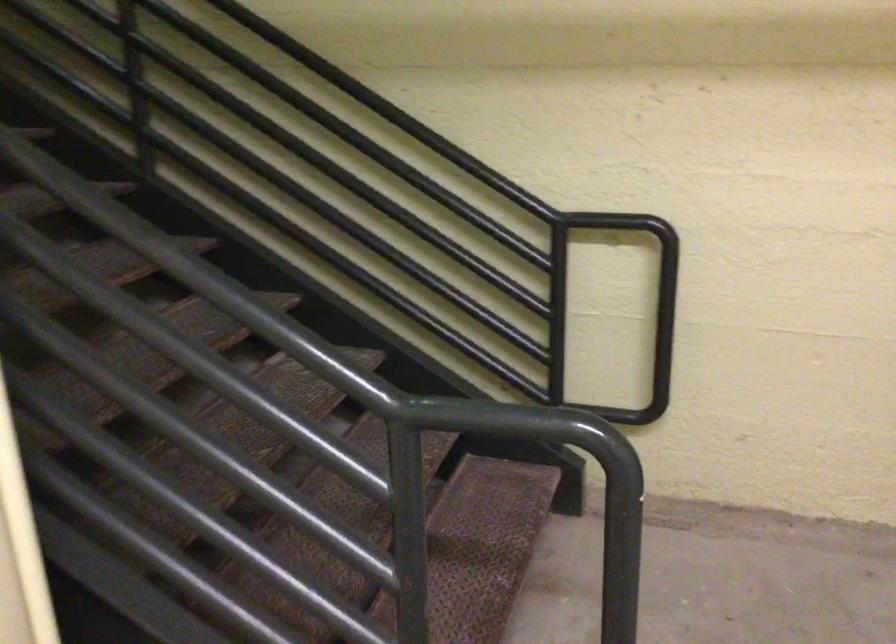
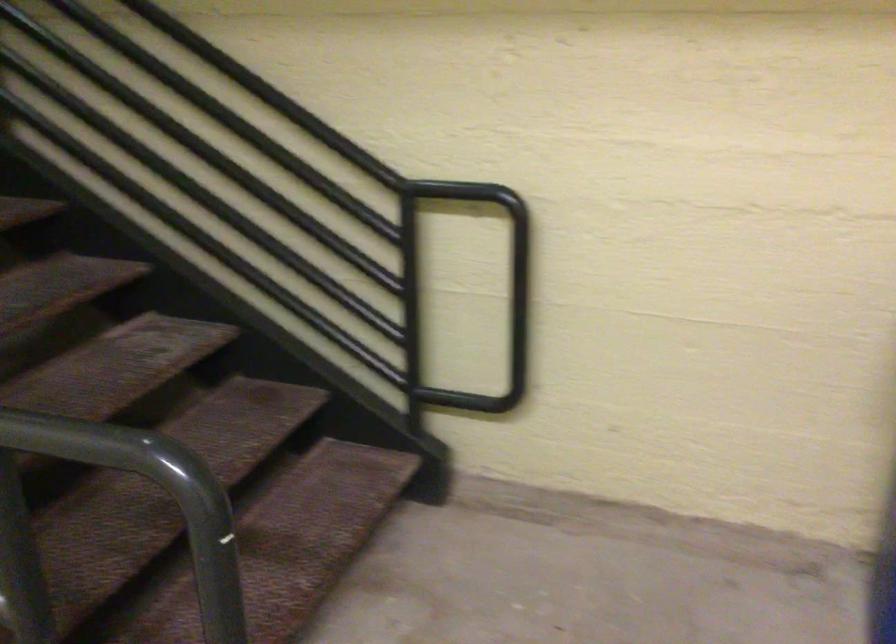
The images are taken continuously from a first-person perspective. In which direction are you moving?

The movement direction of the cameraman is right, forward.